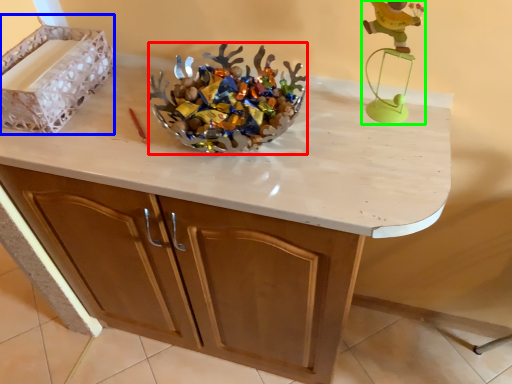
Question: Estimate the real-world distances between objects in this image. Which object is closer to stuff (highlighted by a red box), crate (highlighted by a blue box) or toy (highlighted by a green box)?

Choices:
 (A) crate
 (B) toy

Answer: (B)